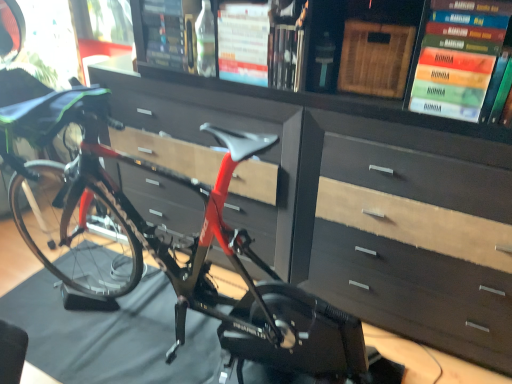
Describe the element at coordinates (243, 41) in the screenshot. Image resolution: width=512 pixels, height=384 pixels. I see `hardcover book at center, which ranks as the fourth book in right-to-left order` at that location.

The height and width of the screenshot is (384, 512). What do you see at coordinates (164, 241) in the screenshot?
I see `shiny red bike at center` at bounding box center [164, 241].

In order to click on hardcover book at upper right, the 1th book viewed from the right in this screenshot , I will do `click(501, 94)`.

Considering the sizes of hardcover book at upper right, arranged as the fifth book when viewed from the left, and hardcover book at center, which ranks as the fourth book in right-to-left order, in the image, is hardcover book at upper right, arranged as the fifth book when viewed from the left, wider or thinner than hardcover book at center, which ranks as the fourth book in right-to-left order,?

Considering their sizes, hardcover book at upper right, arranged as the fifth book when viewed from the left, looks slimmer than hardcover book at center, which ranks as the fourth book in right-to-left order.

Consider the image. How many degrees apart are the facing directions of hardcover book at upper right, arranged as the fifth book when viewed from the left, and hardcover book at center, the second book from the left?

The angular difference between hardcover book at upper right, arranged as the fifth book when viewed from the left, and hardcover book at center, the second book from the left, is 0.795 degrees.

Is hardcover book at upper right, the 1th book viewed from the right, facing away from hardcover book at center, which ranks as the fourth book in right-to-left order?

hardcover book at upper right, the 1th book viewed from the right, does not have its back to hardcover book at center, which ranks as the fourth book in right-to-left order.

From the image's perspective, which book is the 3rd one below the hardcover book at center, the second book from the left? Please provide its 2D coordinates.

[(501, 94)]

Is the surface of shiny red bike at center in direct contact with hardcover book at upper right, the 1th book viewed from the right?

No, shiny red bike at center is not beside hardcover book at upper right, the 1th book viewed from the right.

Consider the image. Is the position of shiny red bike at center more distant than that of hardcover book at upper right, the 1th book viewed from the right?

No, it is not.

Where is `book that is the 1st object located above the shiny red bike at center (from the image's perspective)`? book that is the 1st object located above the shiny red bike at center (from the image's perspective) is located at coordinates (501, 94).

Is shiny red bike at center wider or thinner than hardcover book at upper right, the 1th book viewed from the right?

shiny red bike at center is wider than hardcover book at upper right, the 1th book viewed from the right.

From the image's perspective, which is above, clear glass bottle at center or shiny red bike at center?

From the image's view, clear glass bottle at center is above.

Can you confirm if clear glass bottle at center is wider than shiny red bike at center?

In fact, clear glass bottle at center might be narrower than shiny red bike at center.

In the image, is clear glass bottle at center positioned in front of or behind shiny red bike at center?

clear glass bottle at center is positioned farther from the viewer than shiny red bike at center.

How distant is hardcover book at upper right, the second book in the right-to-left sequence, from hardcover book at upper center, the 1th book viewed from the left?

The distance of hardcover book at upper right, the second book in the right-to-left sequence, from hardcover book at upper center, the 1th book viewed from the left, is 38.28 inches.

Does hardcover book at upper right, the second book in the right-to-left sequence, contain hardcover book at upper center, positioned as the 5th book in right-to-left order?

No, hardcover book at upper center, positioned as the 5th book in right-to-left order, is located outside of hardcover book at upper right, the second book in the right-to-left sequence.

Does hardcover book at upper right, the second book in the right-to-left sequence, have a lesser width compared to hardcover book at upper center, positioned as the 5th book in right-to-left order?

Indeed, hardcover book at upper right, the second book in the right-to-left sequence, has a lesser width compared to hardcover book at upper center, positioned as the 5th book in right-to-left order.

How many degrees apart are the facing directions of hardcover book at upper right, the fourth book in the left-to-right sequence, and hardcover book at upper center, the 1th book viewed from the left?

4.19 degrees.

Looking at this image, does shiny red bike at center touch hardcover book at upper right, the second book in the right-to-left sequence?

No.

Which object is wider, shiny red bike at center or hardcover book at upper right, the fourth book in the left-to-right sequence?

shiny red bike at center is wider.

How much distance is there between shiny red bike at center and hardcover book at upper right, the second book in the right-to-left sequence?

shiny red bike at center is 1.01 meters from hardcover book at upper right, the second book in the right-to-left sequence.

Is shiny red bike at center facing towards hardcover book at upper right, the second book in the right-to-left sequence?

No, shiny red bike at center is not aimed at hardcover book at upper right, the second book in the right-to-left sequence.

Is point (9, 195) more distant than point (173, 69)?

That is True.

Which object is closer to the camera, shiny red bike at center or hardcover book at upper center, the 1th book viewed from the left?

Positioned in front is shiny red bike at center.

Based on the photo, are shiny red bike at center and hardcover book at upper center, the 1th book viewed from the left, far apart?

shiny red bike at center is near hardcover book at upper center, the 1th book viewed from the left, not far away.

From the image's perspective, is shiny red bike at center below hardcover book at upper center, the 1th book viewed from the left?

Yes, from the image's perspective, shiny red bike at center is below hardcover book at upper center, the 1th book viewed from the left.

Considering the relative positions of shiny red bike at center and hardcover book at center, the second book from the left, in the image provided, is shiny red bike at center to the left of hardcover book at center, the second book from the left, from the viewer's perspective?

No.

Is shiny red bike at center taller or shorter than hardcover book at center, the second book from the left?

Clearly, shiny red bike at center is taller compared to hardcover book at center, the second book from the left.

From a real-world perspective, which is physically below, shiny red bike at center or hardcover book at center, which ranks as the fourth book in right-to-left order?

shiny red bike at center is physically lower.

Does point (81, 101) come behind point (251, 57)?

No, it is not.

You are a GUI agent. You are given a task and a screenshot of the screen. Output one action in this format:
    pyautogui.click(x=<x>, y=<y>)
    Task: Click on the 3rd book to the right of the hardcover book at center, the second book from the left, counting from the anchor's position
    The width and height of the screenshot is (512, 384).
    Given the screenshot: What is the action you would take?
    pyautogui.click(x=501, y=94)

There is a shiny red bike at center. Where is `the 2nd book above it (from a real-world perspective)`? the 2nd book above it (from a real-world perspective) is located at coordinates (501, 94).

Based on their spatial positions, is clear glass bottle at center or hardcover book at center, which ranks as the fourth book in right-to-left order, closer to hardcover book at upper center, positioned as the 5th book in right-to-left order?

clear glass bottle at center lies closer to hardcover book at upper center, positioned as the 5th book in right-to-left order, than the other object.

Looking at the image, which one is located further to clear glass bottle at center, shiny red bike at center or hardcover book at upper center, the 3th book when ordered from left to right?

The object further to clear glass bottle at center is shiny red bike at center.

Based on their spatial positions, is hardcover book at center, the second book from the left, or hardcover book at upper right, the 1th book viewed from the right, further from shiny red bike at center?

The object further to shiny red bike at center is hardcover book at upper right, the 1th book viewed from the right.

Considering their positions, is hardcover book at upper right, the second book in the right-to-left sequence, positioned further to clear glass bottle at center than hardcover book at upper center, the 1th book viewed from the left?

hardcover book at upper right, the second book in the right-to-left sequence, is positioned further to the anchor clear glass bottle at center.

Considering their positions, is hardcover book at center, the second book from the left, positioned closer to hardcover book at upper right, the 1th book viewed from the right, than shiny red bike at center?

Based on the image, hardcover book at center, the second book from the left, appears to be nearer to hardcover book at upper right, the 1th book viewed from the right.

Based on their spatial positions, is hardcover book at center, the second book from the left, or hardcover book at upper center, the 3th book when ordered from left to right, closer to clear glass bottle at center?

Based on the image, hardcover book at center, the second book from the left, appears to be nearer to clear glass bottle at center.

Considering their positions, is hardcover book at upper center, positioned as the 5th book in right-to-left order, positioned closer to hardcover book at upper right, the second book in the right-to-left sequence, than hardcover book at upper right, the 1th book viewed from the right?

Based on the image, hardcover book at upper right, the 1th book viewed from the right, appears to be nearer to hardcover book at upper right, the second book in the right-to-left sequence.

Considering their positions, is hardcover book at upper right, the second book in the right-to-left sequence, positioned closer to hardcover book at center, which ranks as the fourth book in right-to-left order, than hardcover book at upper right, the 1th book viewed from the right?

Among the two, hardcover book at upper right, the second book in the right-to-left sequence, is located nearer to hardcover book at center, which ranks as the fourth book in right-to-left order.

Identify the location of bottle between hardcover book at upper center, positioned as the 5th book in right-to-left order, and shiny red bike at center vertically. This screenshot has width=512, height=384. (205, 41).

Locate an element on the screen. bicycle situated between clear glass bottle at center and hardcover book at upper right, the 1th book viewed from the right, from left to right is located at coordinates [x=164, y=241].

The image size is (512, 384). Find the location of `bottle between hardcover book at upper center, the 1th book viewed from the left, and hardcover book at upper right, the 1th book viewed from the right, from left to right`. bottle between hardcover book at upper center, the 1th book viewed from the left, and hardcover book at upper right, the 1th book viewed from the right, from left to right is located at coordinates (205, 41).

This screenshot has width=512, height=384. In order to click on bicycle between hardcover book at center, which ranks as the fourth book in right-to-left order, and hardcover book at upper right, the second book in the right-to-left sequence, from left to right in this screenshot , I will do `click(164, 241)`.